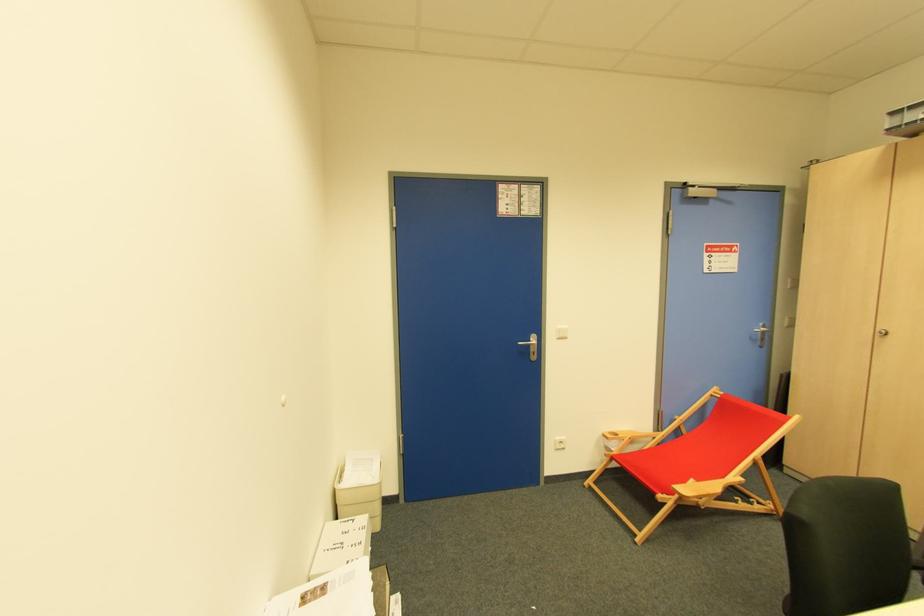
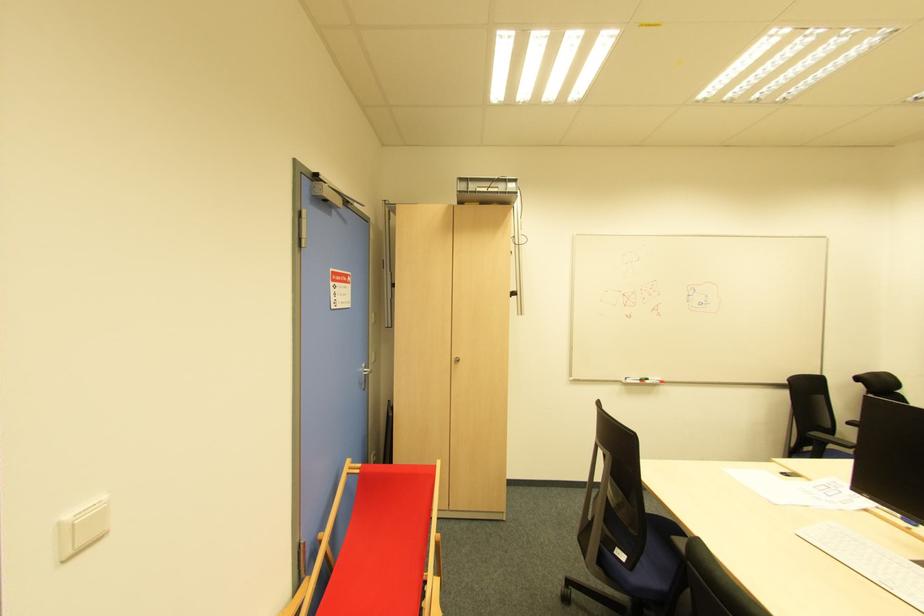
Where in the second image is the point corresponding to point (560, 329) from the first image?

(69, 517)